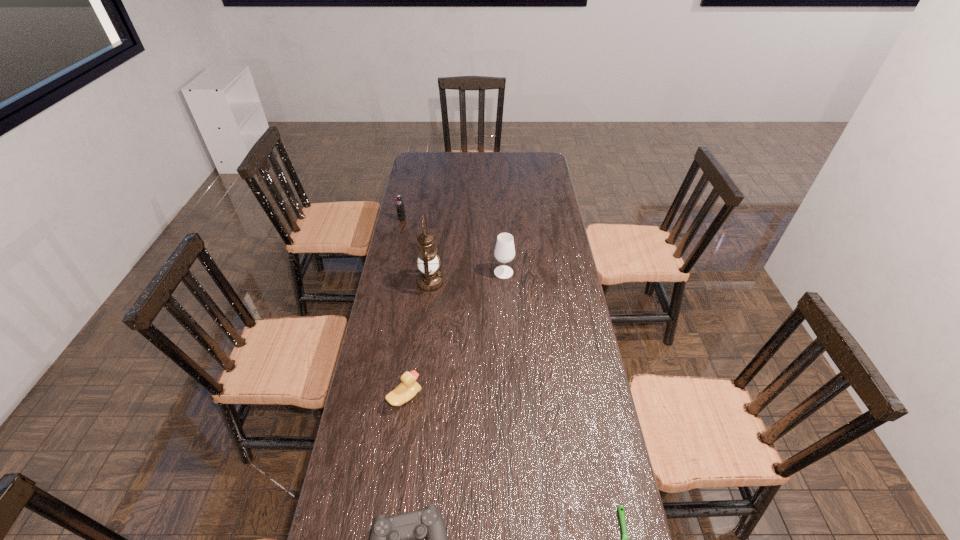
At what (x,y) coordinates should I click in order to perform the action: click on the tallest object. Please return your answer as a coordinate pair (x, y). Looking at the image, I should click on (429, 279).

What are the coordinates of `the second tallest object` in the screenshot? It's located at click(504, 252).

The image size is (960, 540). In order to click on glass in this screenshot , I will do `click(504, 252)`.

This screenshot has width=960, height=540. I want to click on the farthest object, so click(x=401, y=215).

This screenshot has height=540, width=960. Find the location of `pop`. pop is located at coordinates (401, 215).

The width and height of the screenshot is (960, 540). What are the coordinates of `the fourth tallest object` in the screenshot? It's located at (408, 388).

Locate an element on the screen. the fourth farthest object is located at coordinates (408, 388).

Find the location of a particular element. This screenshot has width=960, height=540. vacant point located on the back of the tallest object is located at coordinates (437, 224).

Find the location of a particular element. Image resolution: width=960 pixels, height=540 pixels. free space located 0.080m on the left of the second tallest object is located at coordinates (473, 272).

Where is `vacant space situated on the front label of the pop`? This screenshot has width=960, height=540. vacant space situated on the front label of the pop is located at coordinates (398, 235).